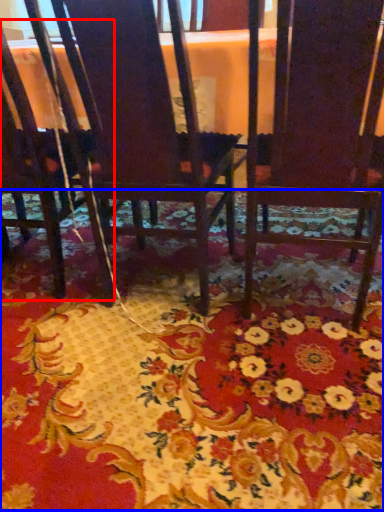
Question: Which object appears farthest to the camera in this image, chair (highlighted by a red box) or mat (highlighted by a blue box)?

Choices:
 (A) chair
 (B) mat

Answer: (A)